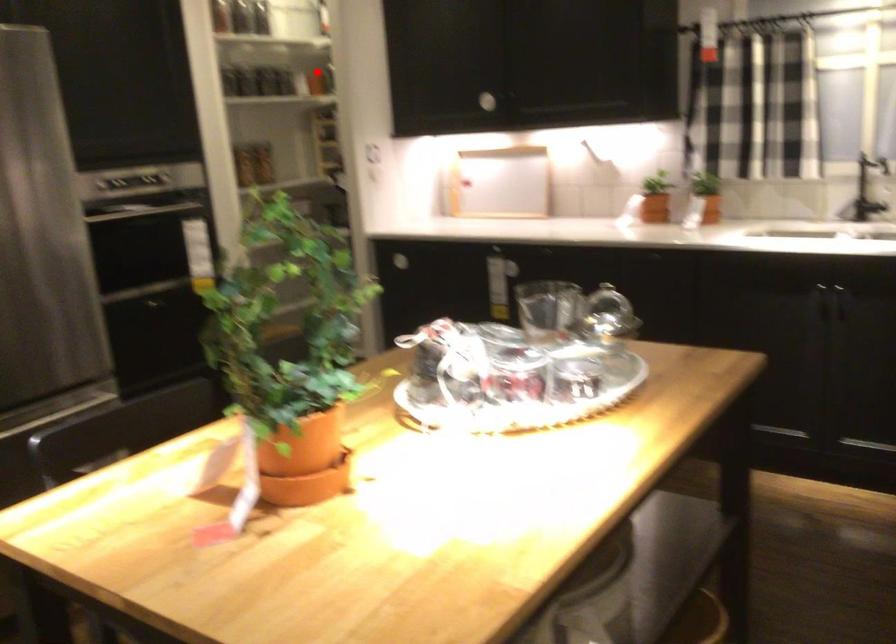
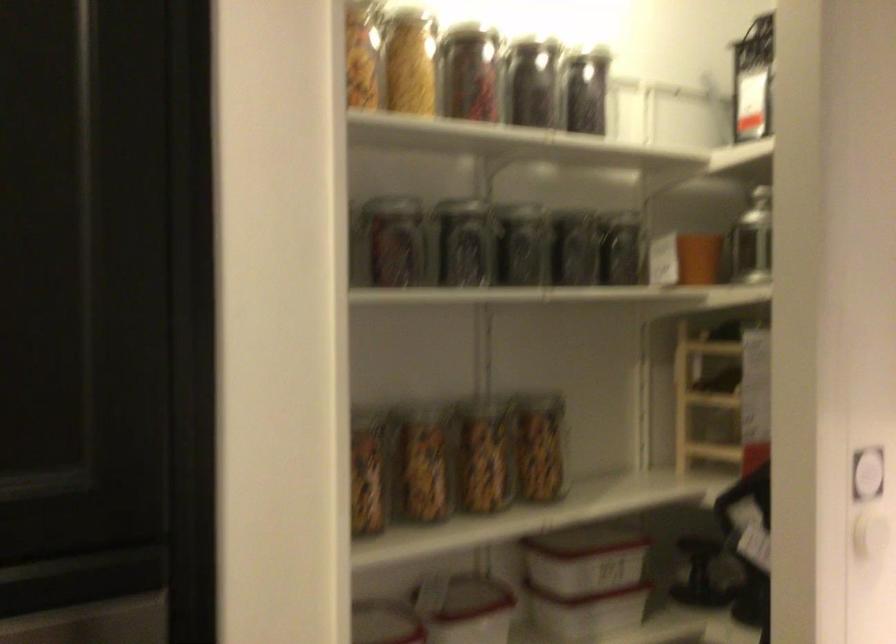
Find the pixel in the second image that matches the highlighted location in the first image.

(698, 258)